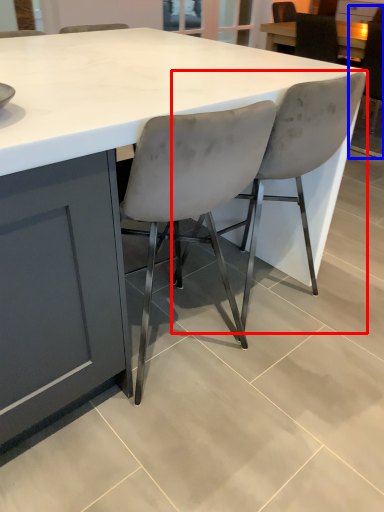
Question: Which object appears closest to the camera in this image, chair (highlighted by a red box) or chair (highlighted by a blue box)?

Choices:
 (A) chair
 (B) chair

Answer: (A)